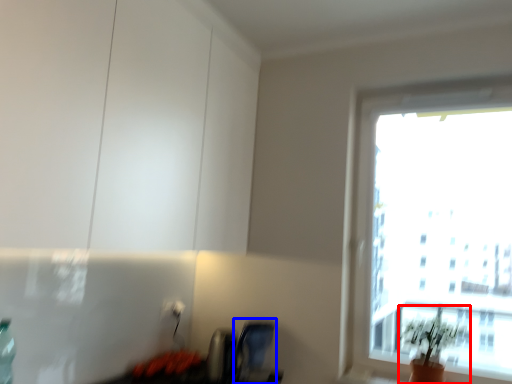
Question: Which of the following is the farthest to the observer, houseplant (highlighted by a red box) or swivel chair (highlighted by a blue box)?

Choices:
 (A) houseplant
 (B) swivel chair

Answer: (B)